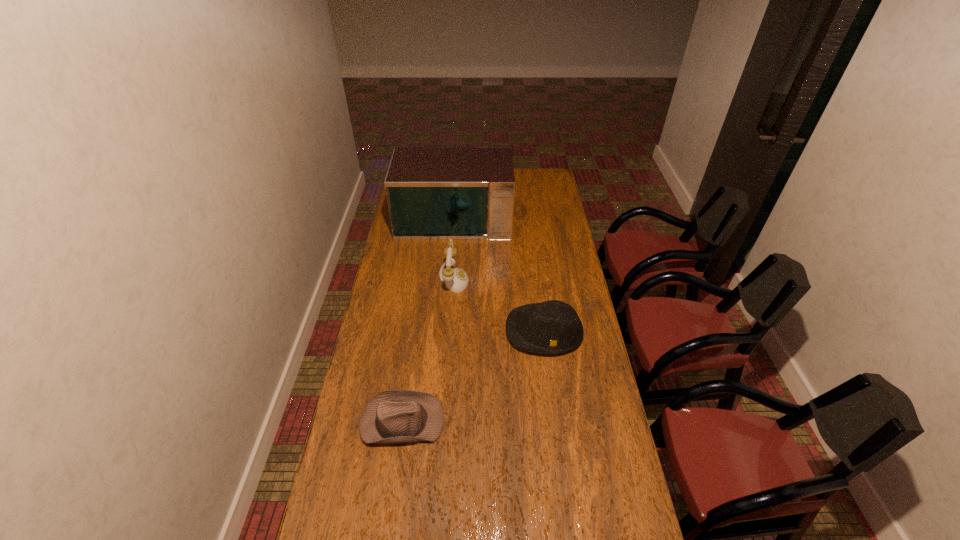
What are the coordinates of `vacant point located 0.170m on the front-facing side of the right fedora` in the screenshot? It's located at (553, 398).

The width and height of the screenshot is (960, 540). In order to click on free region located on the back of the shortest object in this screenshot , I will do `click(410, 363)`.

Locate an element on the screen. microwave oven at the left edge is located at coordinates (433, 193).

Where is `fedora at the left edge`? The image size is (960, 540). fedora at the left edge is located at coordinates (394, 416).

Locate an element on the screen. The image size is (960, 540). object that is at the right edge is located at coordinates (551, 327).

Where is `vacant region at the left edge of the desktop`? vacant region at the left edge of the desktop is located at coordinates (392, 327).

Where is `vacant space at the right edge`? Image resolution: width=960 pixels, height=540 pixels. vacant space at the right edge is located at coordinates (588, 396).

I want to click on vacant region at the far right corner, so click(x=546, y=170).

You are a GUI agent. You are given a task and a screenshot of the screen. Output one action in this format:
    pyautogui.click(x=<x>, y=<y>)
    Task: Click on the vacant space that's between the second nearest object and the farthest object
    The image size is (960, 540).
    Given the screenshot: What is the action you would take?
    pyautogui.click(x=499, y=273)

Where is `free spot between the shortest object and the microwave oven`? free spot between the shortest object and the microwave oven is located at coordinates (428, 319).